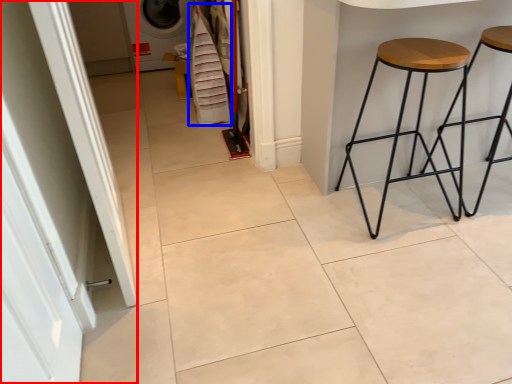
Question: Which of the following is the farthest to the observer, screen door (highlighted by a red box) or laundry (highlighted by a blue box)?

Choices:
 (A) screen door
 (B) laundry

Answer: (B)